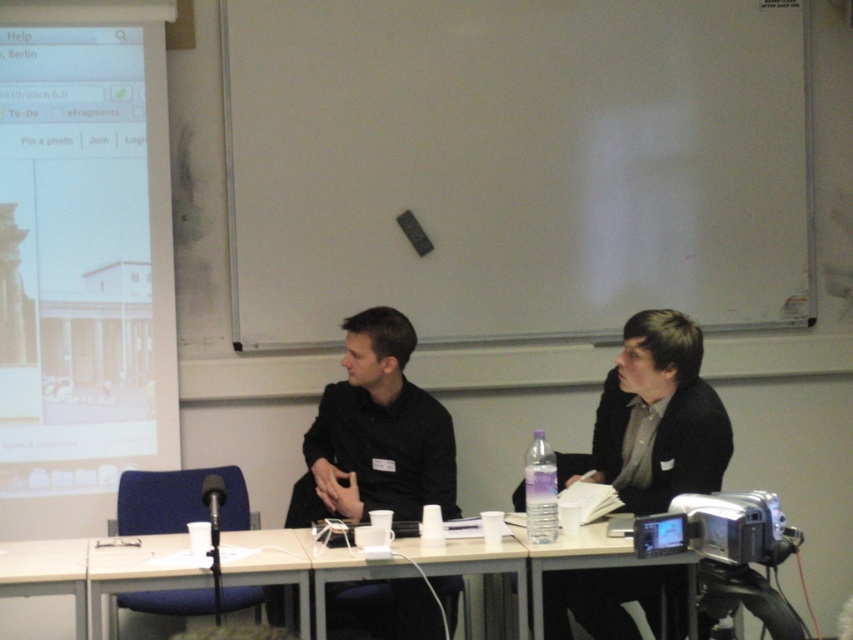
Measure the distance between black matte shirt at center and white plastic table at center.

black matte shirt at center and white plastic table at center are 16.75 inches apart from each other.

Looking at this image, which is below, black matte shirt at center or white plastic table at center?

Positioned lower is white plastic table at center.

Does point (358, 458) come behind point (323, 620)?

Yes.

Where is `black matte shirt at center`? This screenshot has height=640, width=853. black matte shirt at center is located at coordinates (376, 433).

Between white matte projector screen at upper left and white plastic table at lower left, which one appears on the left side from the viewer's perspective?

Positioned to the left is white matte projector screen at upper left.

Between white matte projector screen at upper left and white plastic table at lower left, which one has less height?

Standing shorter between the two is white plastic table at lower left.

Which is behind, point (83, 486) or point (80, 605)?

The point (83, 486) is more distant.

This screenshot has height=640, width=853. I want to click on white matte projector screen at upper left, so click(82, 260).

Based on the photo, does white plastic table at center come in front of white plastic table at lower left?

That is False.

Is white plastic table at center taller than white plastic table at lower left?

Correct, white plastic table at center is much taller as white plastic table at lower left.

Does point (415, 548) come closer to viewer compared to point (16, 577)?

No, it is not.

You are a GUI agent. You are given a task and a screenshot of the screen. Output one action in this format:
    pyautogui.click(x=<x>, y=<y>)
    Task: Click on the white plastic table at center
    The width and height of the screenshot is (853, 640).
    Given the screenshot: What is the action you would take?
    pyautogui.click(x=473, y=563)